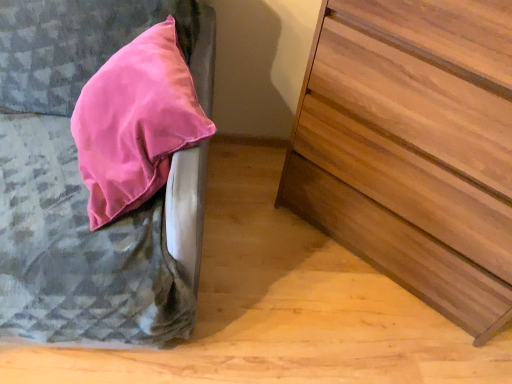
Where is `satin pink pillow at upper left`? satin pink pillow at upper left is located at coordinates (81, 181).

Describe the element at coordinates (81, 181) in the screenshot. I see `satin pink pillow at upper left` at that location.

What do you see at coordinates (413, 148) in the screenshot? I see `wooden chest of drawers at right` at bounding box center [413, 148].

Consider the image. Measure the distance between point (467, 121) and camera.

38.39 inches.

At what (x,y) coordinates should I click in order to perform the action: click on wooden chest of drawers at right. Please return your answer as a coordinate pair (x, y). The image size is (512, 384). Looking at the image, I should click on (413, 148).

The width and height of the screenshot is (512, 384). Identify the location of satin pink pillow at upper left. (81, 181).

Considering the relative positions of wooden chest of drawers at right and satin pink pillow at upper left in the image provided, is wooden chest of drawers at right to the right of satin pink pillow at upper left from the viewer's perspective?

Correct, you'll find wooden chest of drawers at right to the right of satin pink pillow at upper left.

In the image, is wooden chest of drawers at right positioned in front of or behind satin pink pillow at upper left?

Visually, wooden chest of drawers at right is located behind satin pink pillow at upper left.

Is point (445, 72) positioned before point (23, 223)?

No, it is behind (23, 223).

From the image's perspective, is wooden chest of drawers at right over satin pink pillow at upper left?

No, from the image's perspective, wooden chest of drawers at right is not on top of satin pink pillow at upper left.

From a real-world perspective, which object rests below the other?

satin pink pillow at upper left, from a real-world perspective.

Considering the relative sizes of wooden chest of drawers at right and satin pink pillow at upper left in the image provided, is wooden chest of drawers at right wider than satin pink pillow at upper left?

No, wooden chest of drawers at right is not wider than satin pink pillow at upper left.

Based on the photo, is wooden chest of drawers at right shorter than satin pink pillow at upper left?

In fact, wooden chest of drawers at right may be taller than satin pink pillow at upper left.

Considering the sizes of wooden chest of drawers at right and satin pink pillow at upper left in the image, is wooden chest of drawers at right bigger or smaller than satin pink pillow at upper left?

Clearly, wooden chest of drawers at right is smaller in size than satin pink pillow at upper left.

Is satin pink pillow at upper left located within wooden chest of drawers at right?

Actually, satin pink pillow at upper left is outside wooden chest of drawers at right.

Is wooden chest of drawers at right placed right next to satin pink pillow at upper left?

No, wooden chest of drawers at right is not making contact with satin pink pillow at upper left.

Is satin pink pillow at upper left at the back of wooden chest of drawers at right?

wooden chest of drawers at right does not have its back to satin pink pillow at upper left.

What's the angular difference between wooden chest of drawers at right and satin pink pillow at upper left's facing directions?

42.8 degrees.

How far apart are wooden chest of drawers at right and satin pink pillow at upper left?

The distance of wooden chest of drawers at right from satin pink pillow at upper left is 24.31 inches.

Identify the location of chest of drawers to the right of satin pink pillow at upper left. This screenshot has width=512, height=384. (413, 148).

Considering the relative positions of satin pink pillow at upper left and wooden chest of drawers at right in the image provided, is satin pink pillow at upper left to the right of wooden chest of drawers at right from the viewer's perspective?

Incorrect, satin pink pillow at upper left is not on the right side of wooden chest of drawers at right.

Considering the relative positions of satin pink pillow at upper left and wooden chest of drawers at right in the image provided, is satin pink pillow at upper left behind wooden chest of drawers at right?

No, the depth of satin pink pillow at upper left is less than that of wooden chest of drawers at right.

Which is behind, point (144, 234) or point (448, 83)?

Positioned behind is point (448, 83).

From the image's perspective, is satin pink pillow at upper left on wooden chest of drawers at right?

Correct, satin pink pillow at upper left appears higher than wooden chest of drawers at right in the image.

From a real-world perspective, is satin pink pillow at upper left located higher than wooden chest of drawers at right?

Incorrect, from a real-world perspective, satin pink pillow at upper left is lower than wooden chest of drawers at right.

In terms of width, does satin pink pillow at upper left look wider or thinner when compared to wooden chest of drawers at right?

In the image, satin pink pillow at upper left appears to be wider than wooden chest of drawers at right.

Does satin pink pillow at upper left have a greater height compared to wooden chest of drawers at right?

No, satin pink pillow at upper left is not taller than wooden chest of drawers at right.

Considering the sizes of objects satin pink pillow at upper left and wooden chest of drawers at right in the image provided, who is smaller, satin pink pillow at upper left or wooden chest of drawers at right?

Smaller between the two is wooden chest of drawers at right.

Would you say satin pink pillow at upper left is outside wooden chest of drawers at right?

Yes.

Is satin pink pillow at upper left not close to wooden chest of drawers at right?

That's not correct — satin pink pillow at upper left is a little close to wooden chest of drawers at right.

Is satin pink pillow at upper left positioned with its back to wooden chest of drawers at right?

No, satin pink pillow at upper left is not facing away from wooden chest of drawers at right.

How many degrees apart are the facing directions of satin pink pillow at upper left and wooden chest of drawers at right?

42.8 degrees separate the facing orientations of satin pink pillow at upper left and wooden chest of drawers at right.

Identify the location of furniture below the wooden chest of drawers at right (from a real-world perspective). (81, 181).

Image resolution: width=512 pixels, height=384 pixels. Identify the location of furniture lying on the left of wooden chest of drawers at right. (81, 181).

At what (x,y) coordinates should I click in order to perform the action: click on the chest of drawers behind the satin pink pillow at upper left. Please return your answer as a coordinate pair (x, y). This screenshot has height=384, width=512. Looking at the image, I should click on [413, 148].